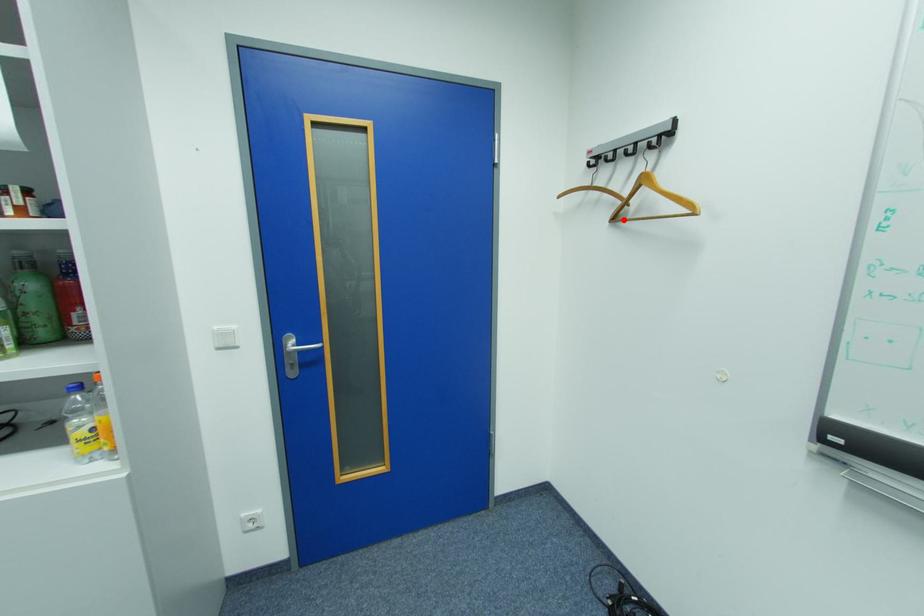
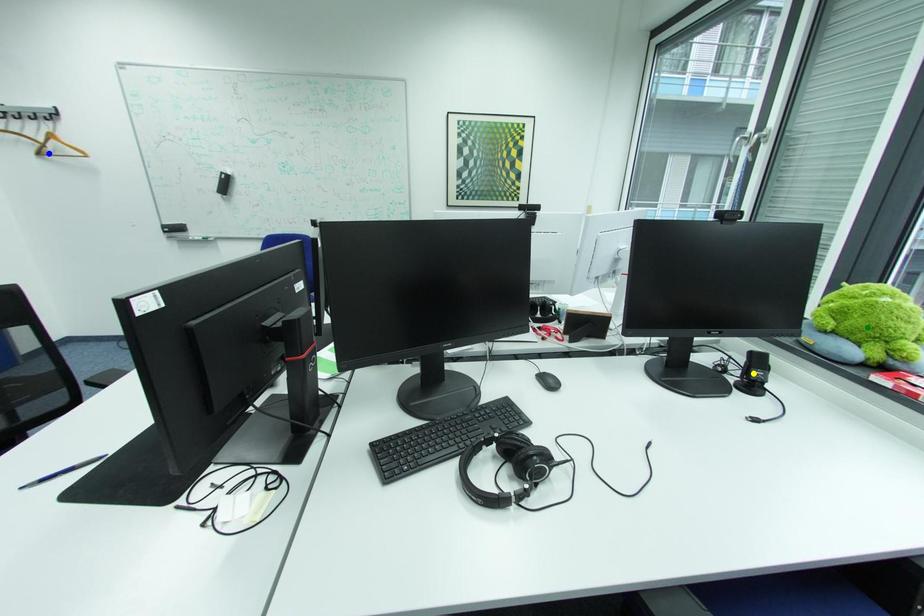
Question: I am providing you with two images of the same scene from different viewpoints. A red point is marked on the first image. You are given multiple points on the second image. Can you choose the point in image 2 that corresponds to the point in image 1?

Choices:
 (A) blue point
 (B) yellow point
 (C) green point

Answer: (A)